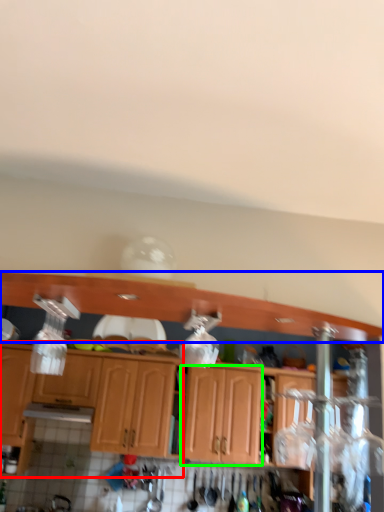
Question: Considering the real-world distances, which object is closest to cabinetry (highlighted by a red box)? cabinetry (highlighted by a blue box) or cabinetry (highlighted by a green box).

Choices:
 (A) cabinetry
 (B) cabinetry

Answer: (B)